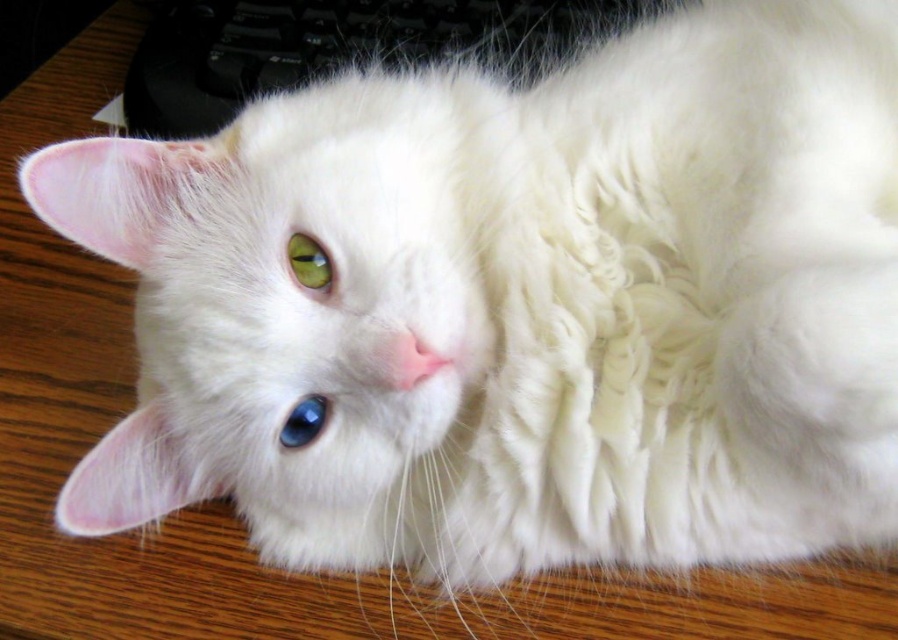
Between black plastic keyboard at upper center and blue glossy eye at center, which one is positioned higher?

black plastic keyboard at upper center is higher up.

What do you see at coordinates (331, 45) in the screenshot?
I see `black plastic keyboard at upper center` at bounding box center [331, 45].

I want to click on black plastic keyboard at upper center, so click(x=331, y=45).

Does point (296, 250) come behind point (298, 432)?

No.

Does green glossy eye at center lie in front of blue glossy eye at center?

Yes, green glossy eye at center is in front of blue glossy eye at center.

Image resolution: width=898 pixels, height=640 pixels. What do you see at coordinates (309, 262) in the screenshot?
I see `green glossy eye at center` at bounding box center [309, 262].

You are a GUI agent. You are given a task and a screenshot of the screen. Output one action in this format:
    pyautogui.click(x=<x>, y=<y>)
    Task: Click on the green glossy eye at center
    This screenshot has width=898, height=640.
    Given the screenshot: What is the action you would take?
    pyautogui.click(x=309, y=262)

Which of these two, black plastic keyboard at upper center or green glossy eye at center, stands taller?

Standing taller between the two is black plastic keyboard at upper center.

Who is lower down, black plastic keyboard at upper center or green glossy eye at center?

green glossy eye at center is lower down.

Identify the location of black plastic keyboard at upper center. The width and height of the screenshot is (898, 640). (331, 45).